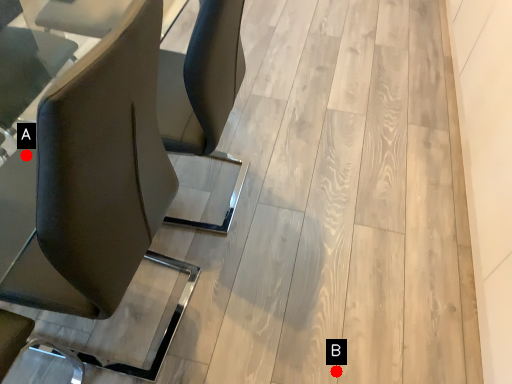
Question: Two points are circled on the image, labeled by A and B beside each circle. Which point is closer to the camera?

Choices:
 (A) A is closer
 (B) B is closer

Answer: (A)